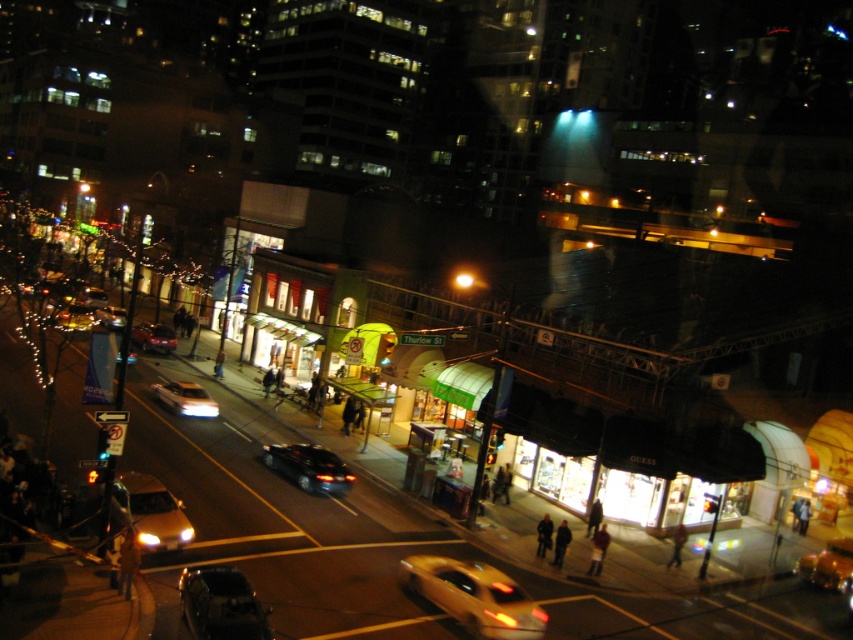
Question: Among these points, which one is nearest to the camera?

Choices:
 (A) (537, 525)
 (B) (189, 572)

Answer: (B)

Question: Which object is closer to the camera taking this photo?

Choices:
 (A) dark brown leather jacket at lower right
 (B) shiny black car at lower left
 (C) dark brown leather jacket at lower center

Answer: (B)

Question: Is dark brown leather jacket at lower left thinner than red velvet coat at lower center?

Choices:
 (A) no
 (B) yes

Answer: (A)

Question: Is shiny red car at center-left bigger than red velvet coat at lower center?

Choices:
 (A) yes
 (B) no

Answer: (B)

Question: Can you confirm if red velvet coat at lower center is positioned below dark brown leather jacket at lower center?

Choices:
 (A) yes
 (B) no

Answer: (A)

Question: Estimate the real-world distances between objects in this image. Which object is farther from the shiny black car at lower left?

Choices:
 (A) yellow metallic taxi at lower right
 (B) dark brown leather jacket at lower right
 (C) shiny silver sedan at center-left
 (D) dark brown leather jacket at lower center

Answer: (C)